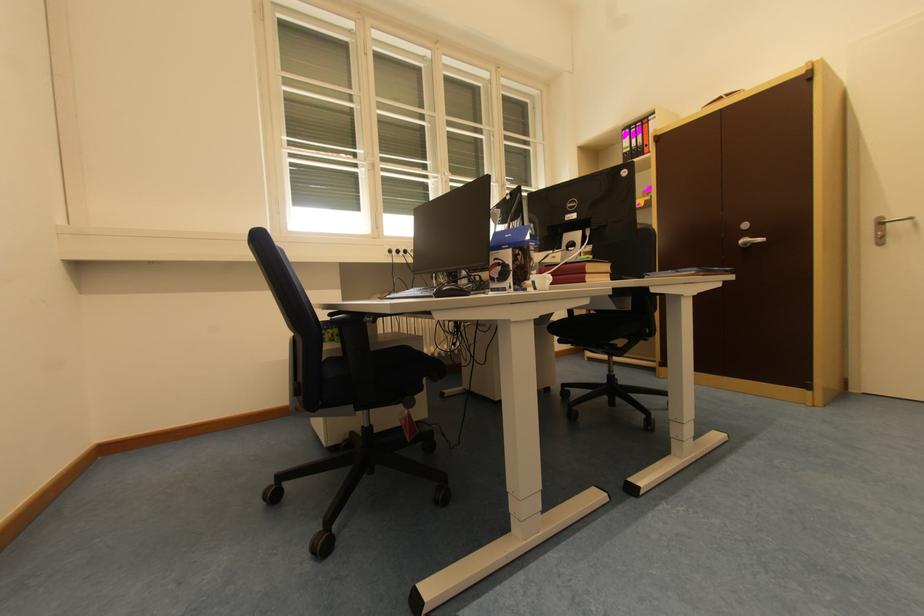
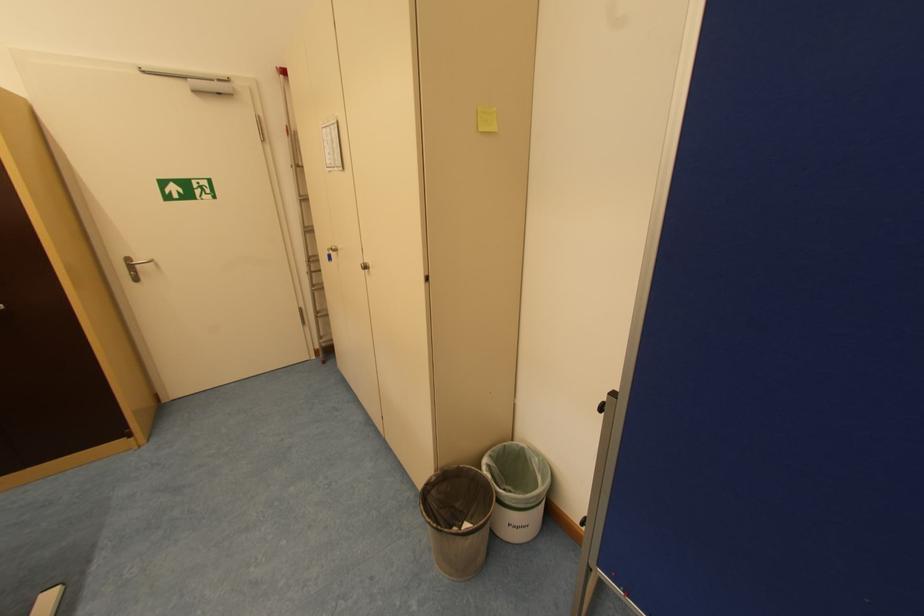
Find the pixel in the second image that matches the point at 888,220 in the first image.

(135, 261)